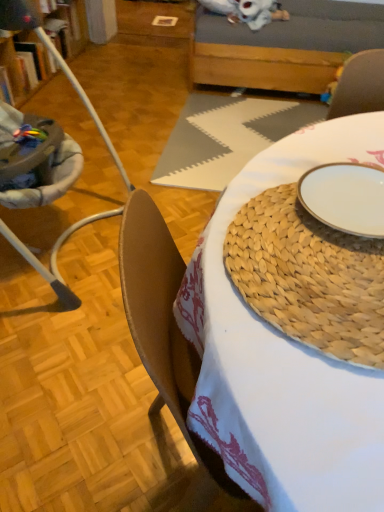
Where is `blank space to the left of woven mat at center`? blank space to the left of woven mat at center is located at coordinates (79, 398).